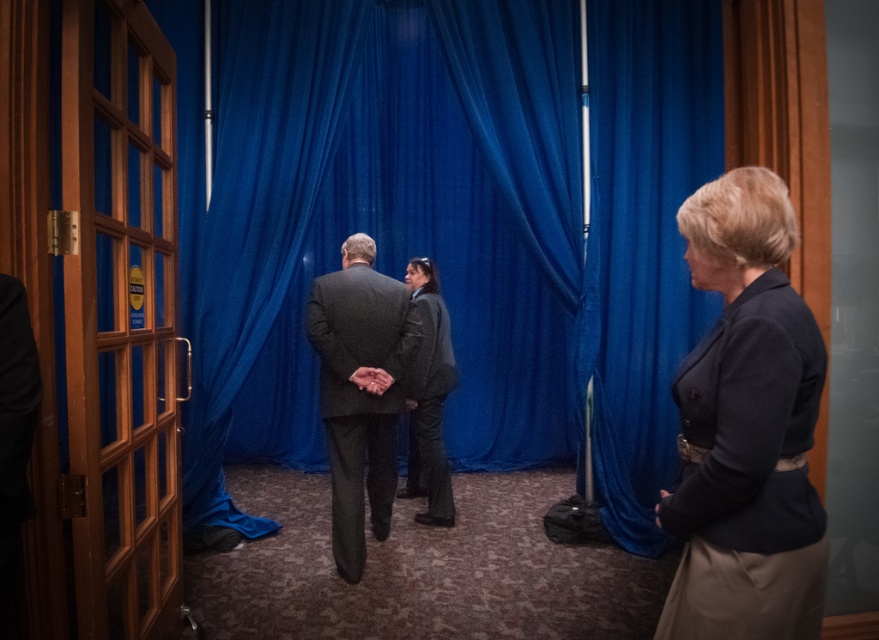
Question: Is dark gray wool blazer at right positioned behind dark gray textured coat at center?

Choices:
 (A) no
 (B) yes

Answer: (A)

Question: Estimate the real-world distances between objects in this image. Which object is closer to the dark gray textured suit at center?

Choices:
 (A) dark gray textured coat at center
 (B) blue velvet curtain at center
 (C) wooden door at left
 (D) dark gray wool blazer at right

Answer: (A)

Question: Which point is farther from the camera taking this photo?

Choices:
 (A) (62, 148)
 (B) (318, 310)

Answer: (B)

Question: Does blue velvet curtain at center have a larger size compared to dark gray textured suit at center?

Choices:
 (A) no
 (B) yes

Answer: (B)

Question: Which of the following is the closest to the observer?

Choices:
 (A) (316, 458)
 (B) (356, 404)
 (C) (745, 444)

Answer: (C)

Question: Is blue velvet curtain at center closer to the viewer compared to dark gray textured coat at center?

Choices:
 (A) yes
 (B) no

Answer: (B)